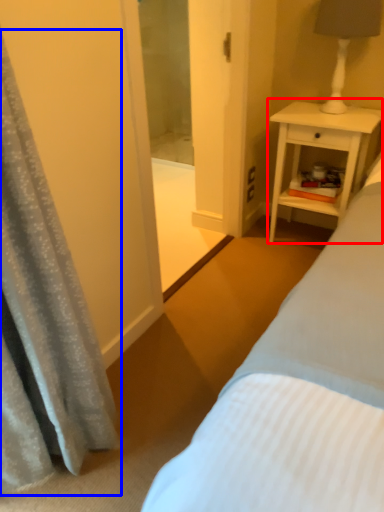
Question: Among these objects, which one is farthest to the camera, nightstand (highlighted by a red box) or curtain (highlighted by a blue box)?

Choices:
 (A) nightstand
 (B) curtain

Answer: (A)